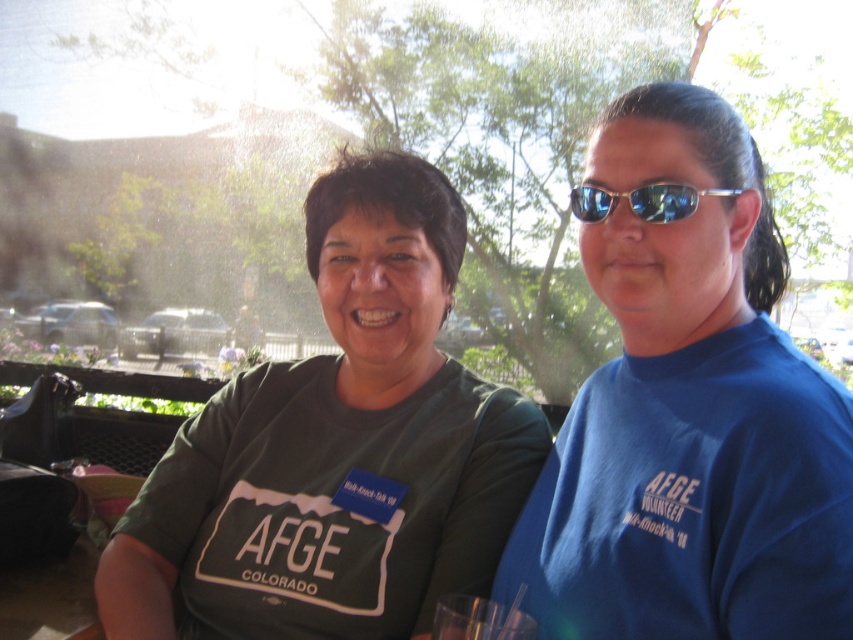
You are a photographer trying to capture the blue T shirt at center. The camera has a focus point at coordinate point (x=689, y=416). Will this focus point help you focus on the blue T shirt at center?

Yes, the focus point at (x=689, y=416) is on the blue T shirt at center, so it will help focus on it.

You are a photographer at the event and want to take a photo of the green matte shirt at center and the sunglasses at right. Based on their sizes in the image, which object should you focus on first to ensure proper framing?

The green matte shirt at center is taller than the sunglasses at right, so you should focus on the green matte shirt at center first to ensure proper framing since it is larger and more prominent in the image.